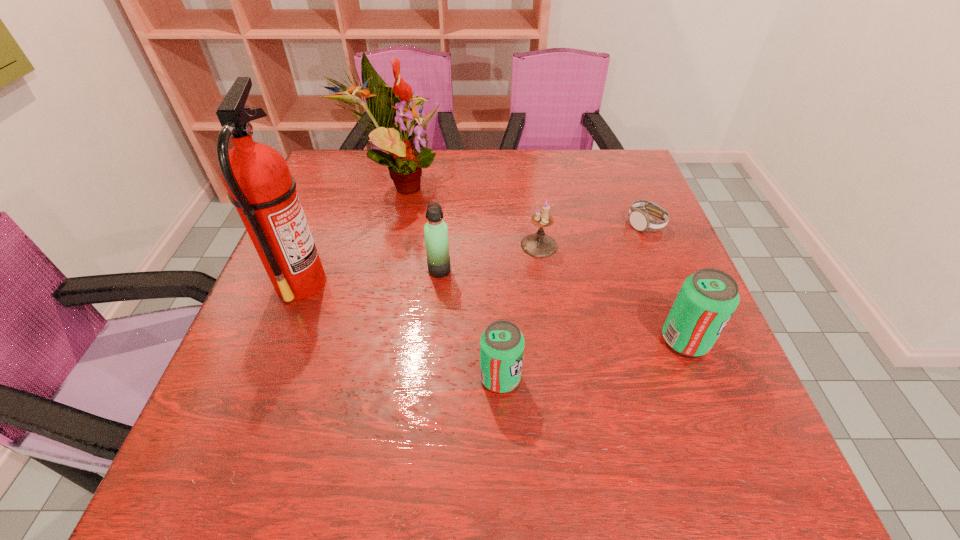
Where is `the left pop soda`? The width and height of the screenshot is (960, 540). the left pop soda is located at coordinates (502, 344).

Identify the location of the fourth object from right to left. (502, 344).

The width and height of the screenshot is (960, 540). What are the coordinates of `the right pop soda` in the screenshot? It's located at (708, 298).

Where is `the farthest object`? The width and height of the screenshot is (960, 540). the farthest object is located at coordinates (388, 107).

This screenshot has height=540, width=960. Find the location of `the second tallest object`. the second tallest object is located at coordinates (388, 107).

Locate an element on the screen. The image size is (960, 540). the tallest object is located at coordinates (260, 186).

At what (x,y) coordinates should I click in order to perform the action: click on the shortest object. Please return your answer as a coordinate pair (x, y). This screenshot has height=540, width=960. Looking at the image, I should click on (640, 220).

Where is `candle holder`? candle holder is located at coordinates (539, 245).

Locate an element on the screen. thermos bottle is located at coordinates (435, 230).

Where is `free space located 0.350m on the front-facing side of the left pop soda`? free space located 0.350m on the front-facing side of the left pop soda is located at coordinates (712, 377).